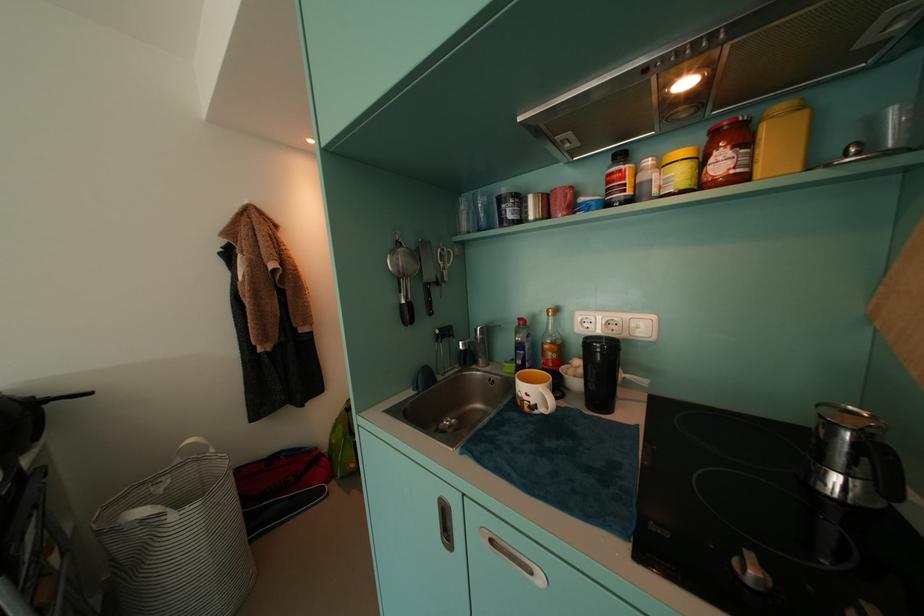
What are the coordinates of `black mug handle` in the screenshot? It's located at (x=854, y=458).